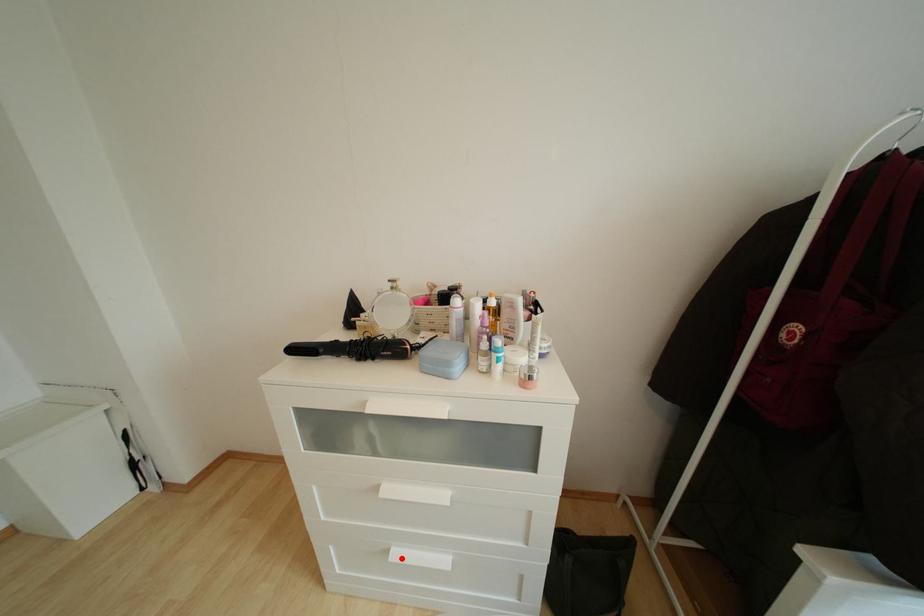
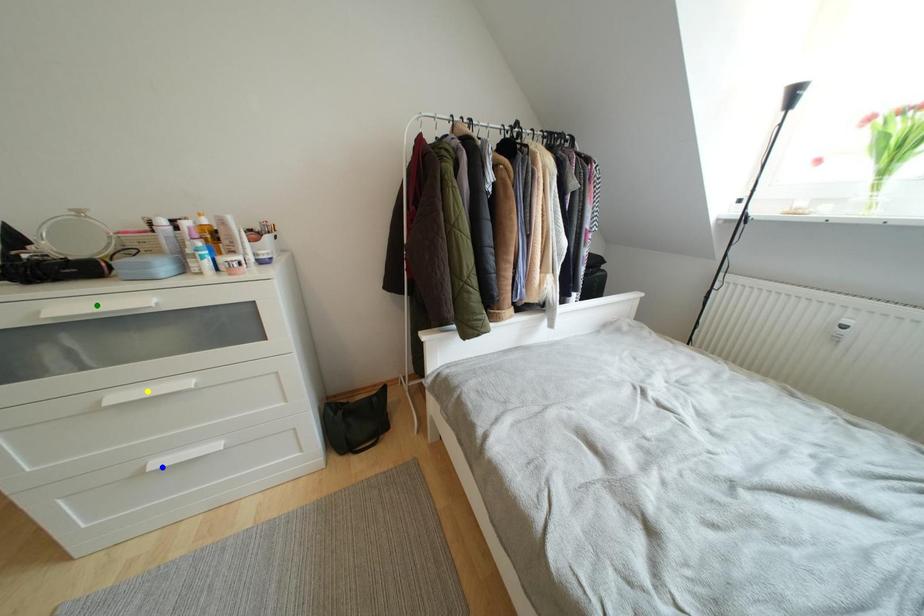
Question: I am providing you with two images of the same scene from different viewpoints. A red point is marked on the first image. You are given multiple points on the second image. In image 2, which mark is for the same physical point as the one in image 1?

Choices:
 (A) blue point
 (B) yellow point
 (C) green point

Answer: (A)